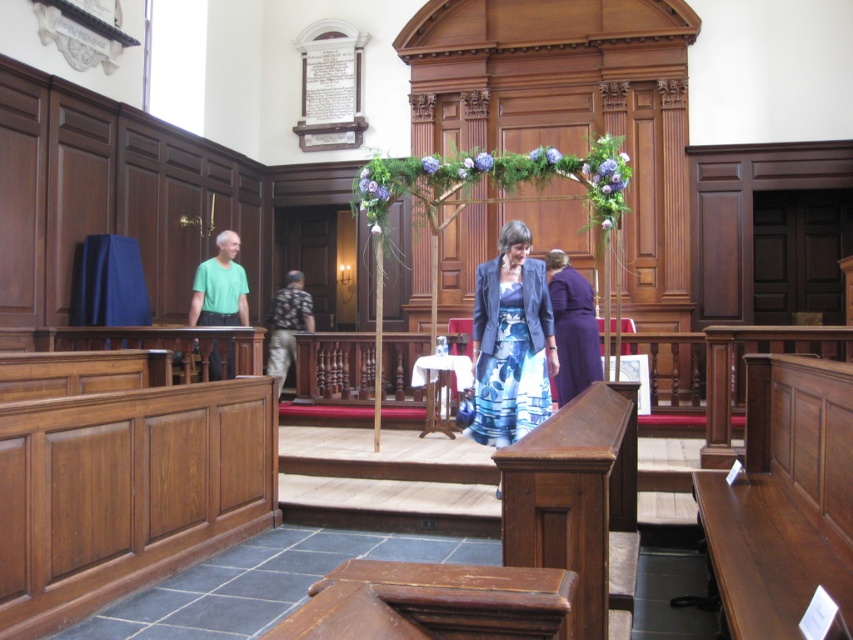
Question: Is blue floral dress at center above green matte t-shirt at left?

Choices:
 (A) no
 (B) yes

Answer: (A)

Question: Which point is closer to the camera?

Choices:
 (A) (570, 300)
 (B) (283, 368)

Answer: (A)

Question: Is green matte t-shirt at left to the right of floral-patterned fabric at center from the viewer's perspective?

Choices:
 (A) no
 (B) yes

Answer: (A)

Question: Does blue floral dress at center appear over green matte t-shirt at left?

Choices:
 (A) yes
 (B) no

Answer: (B)

Question: Estimate the real-world distances between objects in this image. Which object is closer to the purple satin dress at center?

Choices:
 (A) green matte t-shirt at left
 (B) floral-patterned fabric at center

Answer: (A)

Question: Which point appears closest to the camera in this image?

Choices:
 (A) (296, 320)
 (B) (230, 243)
 (C) (560, 364)

Answer: (C)